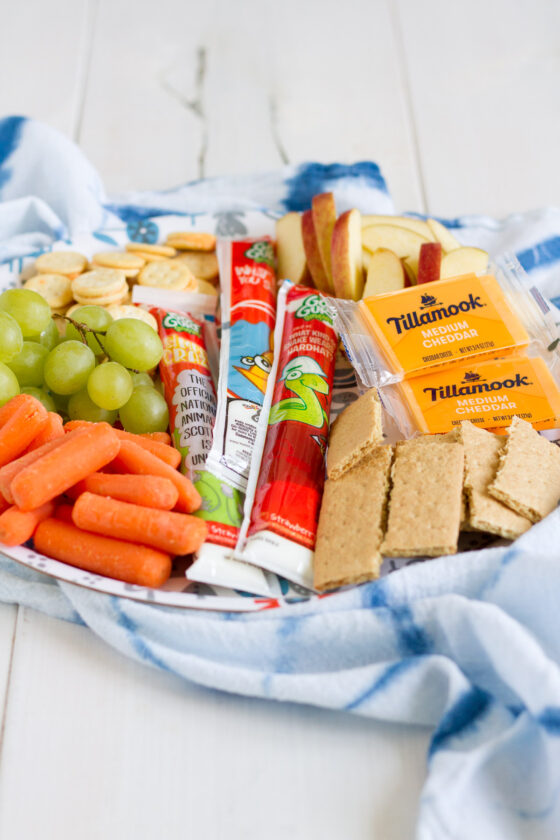
The width and height of the screenshot is (560, 840). What are the coordinates of `plate` in the screenshot? It's located at (251, 612).